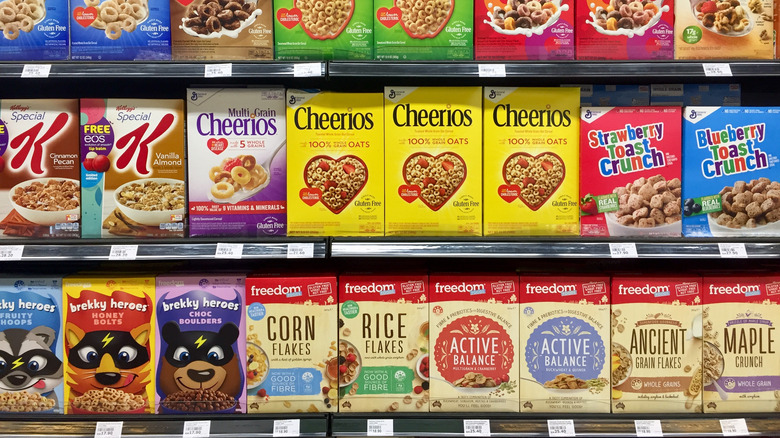
Locate an element on the screen. cereal on the middle row is located at coordinates [45, 153], [126, 160], [250, 151], [353, 158], [441, 162], [519, 188], [630, 166], [741, 146].